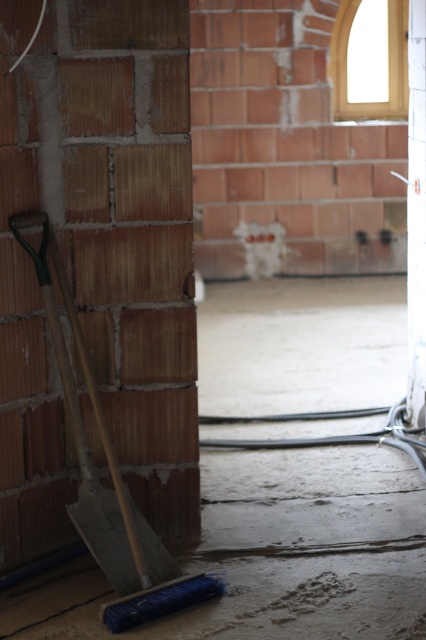
Question: Which point is closer to the camera taking this photo?

Choices:
 (A) (420, 68)
 (B) (279, 426)
 (C) (66, 401)

Answer: (C)

Question: Can you confirm if blue bristle broom at left is positioned to the right of white glossy pillar at center?

Choices:
 (A) yes
 (B) no

Answer: (B)

Question: Which of the following is the closest to the observer?

Choices:
 (A) (83, 472)
 (B) (345, 305)

Answer: (A)

Question: From the image, what is the correct spatial relationship of blue bristle broom at left in relation to white glossy pillar at center?

Choices:
 (A) below
 (B) above

Answer: (A)

Question: Does blue bristle broom at left have a lesser width compared to wooden shovel at left?

Choices:
 (A) yes
 (B) no

Answer: (B)

Question: Which is nearer to the white glossy pillar at center?

Choices:
 (A) blue bristle broom at left
 (B) wooden shovel at left

Answer: (A)